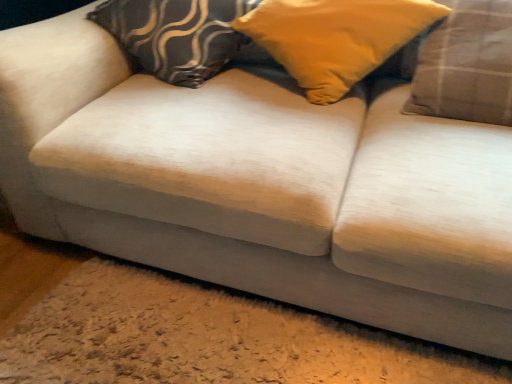
Describe the element at coordinates (335, 38) in the screenshot. I see `yellow fabric pillow at center, the 2th pillow viewed from the left` at that location.

In order to face plaid fabric pillow at right, which is the first pillow from right to left, should I rotate leftwards or rightwards?

To face it directly, rotate right by 25.964 degrees.

The width and height of the screenshot is (512, 384). What do you see at coordinates (176, 35) in the screenshot?
I see `velvet-patterned pillow at center, which ranks as the first pillow in left-to-right order` at bounding box center [176, 35].

Locate an element on the screen. This screenshot has width=512, height=384. yellow fabric pillow at center, marked as the 2th pillow in a right-to-left arrangement is located at coordinates (335, 38).

Is plaid fabric pillow at right, which is the third pillow from left to right, shorter than yellow fabric pillow at center, the 2th pillow viewed from the left?

No.

Which pillow is the 1st one when counting from the back of the plaid fabric pillow at right, which is the first pillow from right to left? Please provide its 2D coordinates.

[(335, 38)]

From a real-world perspective, which object rests below the other?

In real-world perspective, plaid fabric pillow at right, which is the first pillow from right to left, is lower.

Considering the relative sizes of plaid fabric pillow at right, which is the first pillow from right to left, and yellow fabric pillow at center, the 2th pillow viewed from the left, in the image provided, is plaid fabric pillow at right, which is the first pillow from right to left, thinner than yellow fabric pillow at center, the 2th pillow viewed from the left,?

Correct, the width of plaid fabric pillow at right, which is the first pillow from right to left, is less than that of yellow fabric pillow at center, the 2th pillow viewed from the left.

Which object is wider, yellow fabric pillow at center, marked as the 2th pillow in a right-to-left arrangement, or plaid fabric pillow at right, which is the first pillow from right to left?

Wider between the two is yellow fabric pillow at center, marked as the 2th pillow in a right-to-left arrangement.

Looking at the image, does yellow fabric pillow at center, the 2th pillow viewed from the left, seem bigger or smaller compared to plaid fabric pillow at right, which is the third pillow from left to right?

In the image, yellow fabric pillow at center, the 2th pillow viewed from the left, appears to be larger than plaid fabric pillow at right, which is the third pillow from left to right.

Does yellow fabric pillow at center, marked as the 2th pillow in a right-to-left arrangement, touch plaid fabric pillow at right, which is the first pillow from right to left?

They are not placed beside each other.

Between point (419, 24) and point (503, 106), which one is positioned behind?

The point (419, 24) is farther from the camera.

Image resolution: width=512 pixels, height=384 pixels. Identify the location of pillow that appears on the left of yellow fabric pillow at center, marked as the 2th pillow in a right-to-left arrangement. (176, 35).

How far apart are yellow fabric pillow at center, the 2th pillow viewed from the left, and velvet-patterned pillow at center, which ranks as the first pillow in left-to-right order?

yellow fabric pillow at center, the 2th pillow viewed from the left, and velvet-patterned pillow at center, which ranks as the first pillow in left-to-right order, are 26.04 centimeters apart from each other.

Is yellow fabric pillow at center, the 2th pillow viewed from the left, completely or partially outside of velvet-patterned pillow at center, the third pillow in the right-to-left sequence?

That's correct, yellow fabric pillow at center, the 2th pillow viewed from the left, is outside of velvet-patterned pillow at center, the third pillow in the right-to-left sequence.

Is yellow fabric pillow at center, marked as the 2th pillow in a right-to-left arrangement, shorter than velvet-patterned pillow at center, the third pillow in the right-to-left sequence?

No, yellow fabric pillow at center, marked as the 2th pillow in a right-to-left arrangement, is not shorter than velvet-patterned pillow at center, the third pillow in the right-to-left sequence.

Between point (115, 4) and point (438, 41), which one is positioned behind?

The point (115, 4) is more distant.

From the image's perspective, which is below, velvet-patterned pillow at center, the third pillow in the right-to-left sequence, or plaid fabric pillow at right, which is the first pillow from right to left?

plaid fabric pillow at right, which is the first pillow from right to left, is shown below in the image.

Considering the positions of objects velvet-patterned pillow at center, the third pillow in the right-to-left sequence, and plaid fabric pillow at right, which is the third pillow from left to right, in the image provided, who is more to the right, velvet-patterned pillow at center, the third pillow in the right-to-left sequence, or plaid fabric pillow at right, which is the third pillow from left to right,?

plaid fabric pillow at right, which is the third pillow from left to right.

Is plaid fabric pillow at right, which is the first pillow from right to left, at the left side of velvet-patterned pillow at center, the third pillow in the right-to-left sequence?

No.

Which object is wider, plaid fabric pillow at right, which is the third pillow from left to right, or velvet-patterned pillow at center, which ranks as the first pillow in left-to-right order?

With larger width is velvet-patterned pillow at center, which ranks as the first pillow in left-to-right order.

Locate an element on the screen. This screenshot has height=384, width=512. pillow below the plaid fabric pillow at right, which is the first pillow from right to left (from a real-world perspective) is located at coordinates (176, 35).

Looking at this image, which of these two, velvet-patterned pillow at center, which ranks as the first pillow in left-to-right order, or yellow fabric pillow at center, the 2th pillow viewed from the left, is thinner?

Thinner between the two is velvet-patterned pillow at center, which ranks as the first pillow in left-to-right order.

Considering the relative sizes of velvet-patterned pillow at center, the third pillow in the right-to-left sequence, and yellow fabric pillow at center, marked as the 2th pillow in a right-to-left arrangement, in the image provided, is velvet-patterned pillow at center, the third pillow in the right-to-left sequence, shorter than yellow fabric pillow at center, marked as the 2th pillow in a right-to-left arrangement,?

Yes.

Is yellow fabric pillow at center, marked as the 2th pillow in a right-to-left arrangement, at the back of velvet-patterned pillow at center, which ranks as the first pillow in left-to-right order?

velvet-patterned pillow at center, which ranks as the first pillow in left-to-right order, does not have its back to yellow fabric pillow at center, marked as the 2th pillow in a right-to-left arrangement.

Is velvet-patterned pillow at center, the third pillow in the right-to-left sequence, not near yellow fabric pillow at center, marked as the 2th pillow in a right-to-left arrangement?

No, velvet-patterned pillow at center, the third pillow in the right-to-left sequence, is in close proximity to yellow fabric pillow at center, marked as the 2th pillow in a right-to-left arrangement.

I want to click on pillow on the right of yellow fabric pillow at center, marked as the 2th pillow in a right-to-left arrangement, so click(467, 65).

Find the location of a particular element. The image size is (512, 384). pillow below the yellow fabric pillow at center, the 2th pillow viewed from the left (from the image's perspective) is located at coordinates (467, 65).

Estimate the real-world distances between objects in this image. Which object is closer to velvet-patterned pillow at center, which ranks as the first pillow in left-to-right order, plaid fabric pillow at right, which is the third pillow from left to right, or yellow fabric pillow at center, the 2th pillow viewed from the left?

→ yellow fabric pillow at center, the 2th pillow viewed from the left, is closer to velvet-patterned pillow at center, which ranks as the first pillow in left-to-right order.

From the image, which object appears to be nearer to plaid fabric pillow at right, which is the third pillow from left to right, velvet-patterned pillow at center, the third pillow in the right-to-left sequence, or yellow fabric pillow at center, marked as the 2th pillow in a right-to-left arrangement?

yellow fabric pillow at center, marked as the 2th pillow in a right-to-left arrangement, is closer to plaid fabric pillow at right, which is the third pillow from left to right.

From the image, which object appears to be farther from yellow fabric pillow at center, the 2th pillow viewed from the left, plaid fabric pillow at right, which is the first pillow from right to left, or velvet-patterned pillow at center, the third pillow in the right-to-left sequence?

The object further to yellow fabric pillow at center, the 2th pillow viewed from the left, is velvet-patterned pillow at center, the third pillow in the right-to-left sequence.

Which object lies nearer to the anchor point plaid fabric pillow at right, which is the third pillow from left to right, yellow fabric pillow at center, the 2th pillow viewed from the left, or velvet-patterned pillow at center, the third pillow in the right-to-left sequence?

yellow fabric pillow at center, the 2th pillow viewed from the left, is closer to plaid fabric pillow at right, which is the third pillow from left to right.

When comparing their distances from yellow fabric pillow at center, the 2th pillow viewed from the left, does velvet-patterned pillow at center, the third pillow in the right-to-left sequence, or plaid fabric pillow at right, which is the third pillow from left to right, seem further?

Among the two, velvet-patterned pillow at center, the third pillow in the right-to-left sequence, is located further to yellow fabric pillow at center, the 2th pillow viewed from the left.

Which object lies further to the anchor point velvet-patterned pillow at center, which ranks as the first pillow in left-to-right order, yellow fabric pillow at center, marked as the 2th pillow in a right-to-left arrangement, or plaid fabric pillow at right, which is the first pillow from right to left?

Among the two, plaid fabric pillow at right, which is the first pillow from right to left, is located further to velvet-patterned pillow at center, which ranks as the first pillow in left-to-right order.

Identify the location of pillow between velvet-patterned pillow at center, which ranks as the first pillow in left-to-right order, and plaid fabric pillow at right, which is the first pillow from right to left, in the horizontal direction. (335, 38).